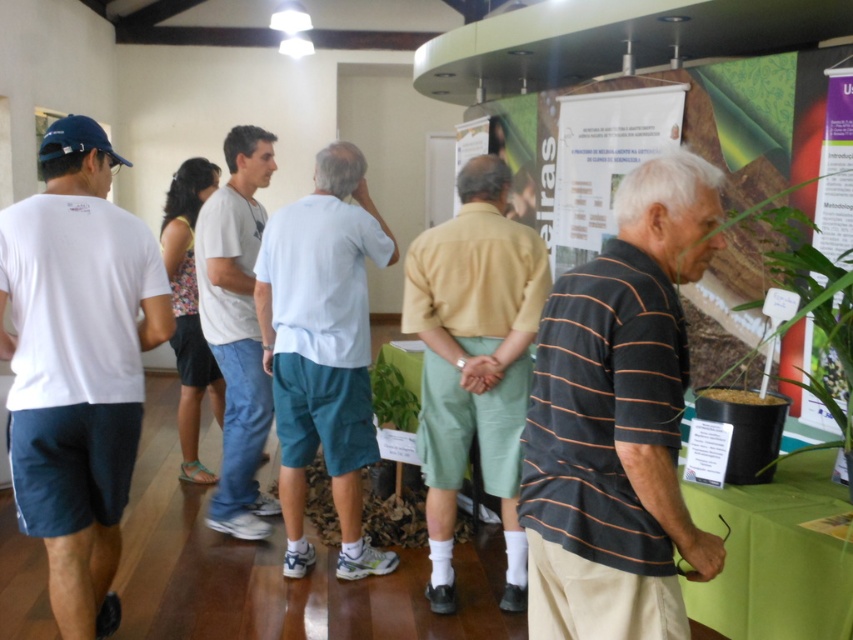
You are standing in the room and want to find the black striped shirt at right. According to the coordinates provided, where should you look?

You should look at point (x=618, y=419) to find the black striped shirt at right.